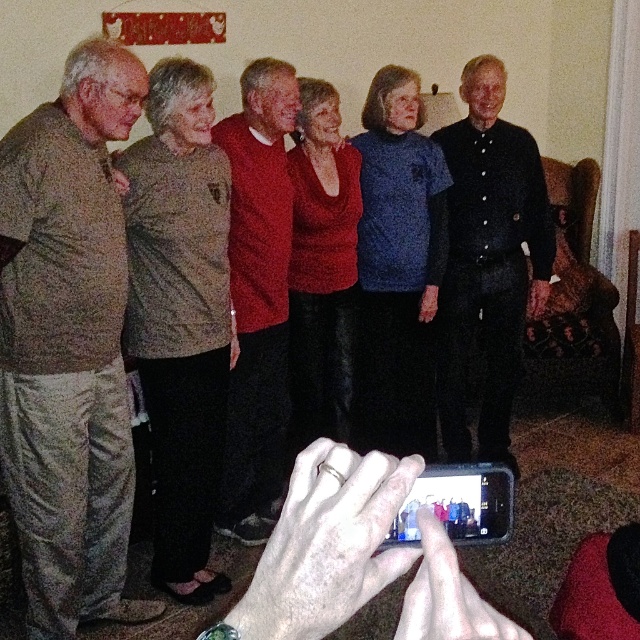
Looking at this image, which of these two, camouflage pants at left or black button-up shirt at center, stands shorter?

camouflage pants at left is shorter.

Which is behind, point (16, 465) or point (477, 449)?

Point (477, 449)

At what (x,y) coordinates should I click in order to perform the action: click on camouflage pants at left. Please return your answer as a coordinate pair (x, y). The width and height of the screenshot is (640, 640). Looking at the image, I should click on (68, 344).

Does matte brown sweater at upper left appear on the left side of black matte smartphone at lower center?

Correct, you'll find matte brown sweater at upper left to the left of black matte smartphone at lower center.

Is point (220, 278) less distant than point (449, 506)?

No, (220, 278) is behind (449, 506).

This screenshot has width=640, height=640. I want to click on matte brown sweater at upper left, so click(180, 316).

Is point (104, 269) positioned after point (180, 115)?

That is False.

Measure the distance between camouflage pants at left and camera.

camouflage pants at left is 5.78 feet away from camera.

Does point (83, 502) come farther from viewer compared to point (180, 205)?

No, (83, 502) is closer to viewer.

You are a GUI agent. You are given a task and a screenshot of the screen. Output one action in this format:
    pyautogui.click(x=<x>, y=<y>)
    Task: Click on the camouflage pants at left
    The height and width of the screenshot is (640, 640).
    Given the screenshot: What is the action you would take?
    pyautogui.click(x=68, y=344)